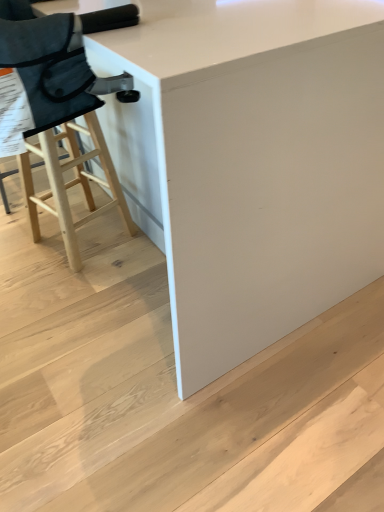
Identify the location of vacant space in front of natural wood stool at left. (67, 292).